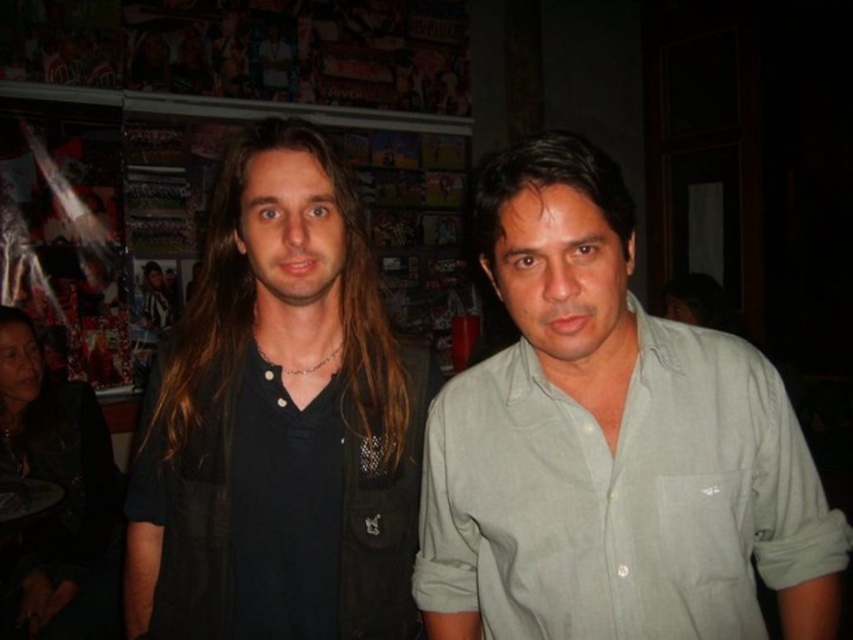
Question: Can you confirm if light green cotton shirt at center is smaller than black matte shirt at center?

Choices:
 (A) no
 (B) yes

Answer: (A)

Question: Among these points, which one is nearest to the camera?

Choices:
 (A) (367, 579)
 (B) (753, 621)

Answer: (B)

Question: Can you confirm if light green cotton shirt at center is positioned to the right of black matte shirt at center?

Choices:
 (A) no
 (B) yes

Answer: (B)

Question: Does light green cotton shirt at center appear on the left side of black matte shirt at center?

Choices:
 (A) no
 (B) yes

Answer: (A)